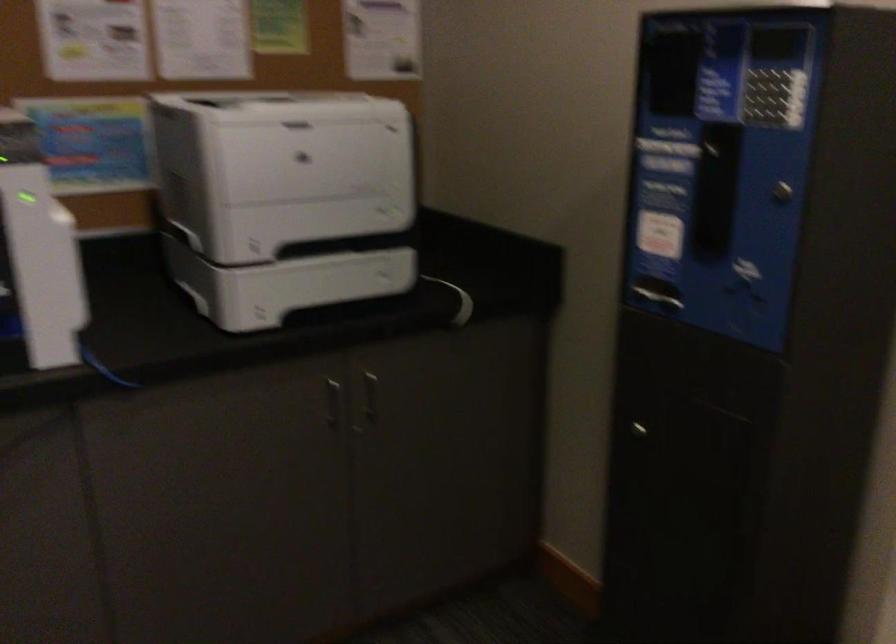
Describe the element at coordinates (765, 106) in the screenshot. I see `the machine keypad` at that location.